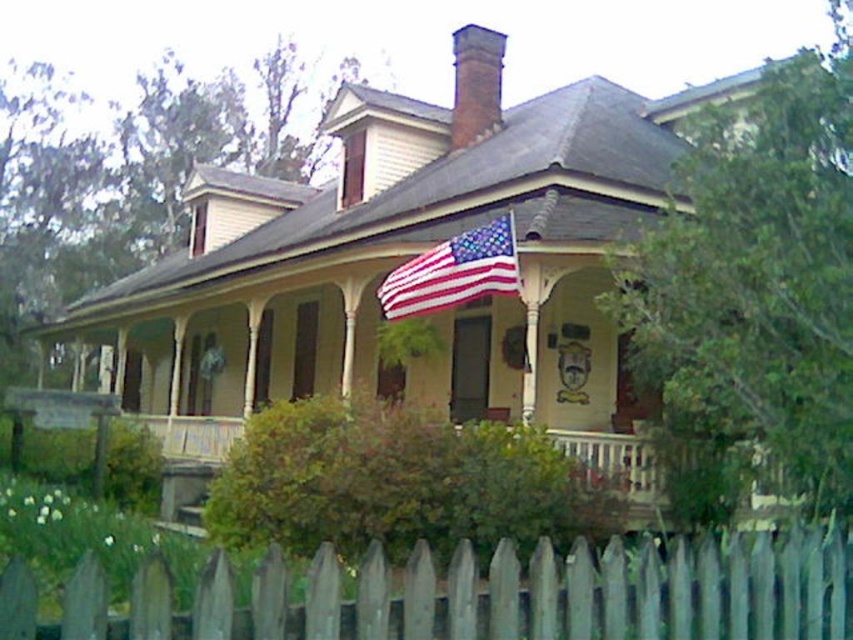
Can you confirm if gray wooden fence at lower center is positioned above american flag at center?

No.

At what (x,y) coordinates should I click in order to perform the action: click on gray wooden fence at lower center. Please return your answer as a coordinate pair (x, y). The height and width of the screenshot is (640, 853). Looking at the image, I should click on (480, 595).

Between point (32, 605) and point (390, 284), which one is positioned in front?

Point (32, 605) is more forward.

Where is `gray wooden fence at lower center`? The image size is (853, 640). gray wooden fence at lower center is located at coordinates (x=480, y=595).